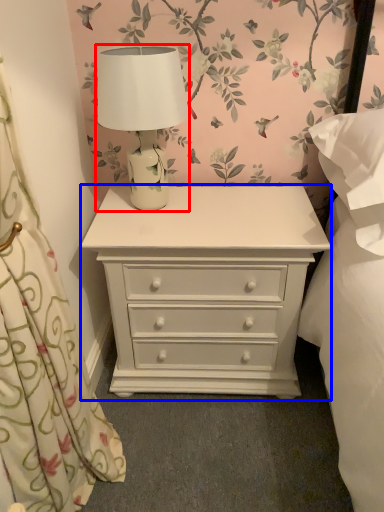
Question: Which object is closer to the camera taking this photo, table lamp (highlighted by a red box) or chest of drawers (highlighted by a blue box)?

Choices:
 (A) table lamp
 (B) chest of drawers

Answer: (A)